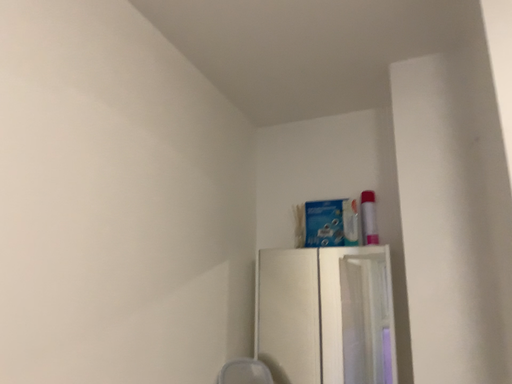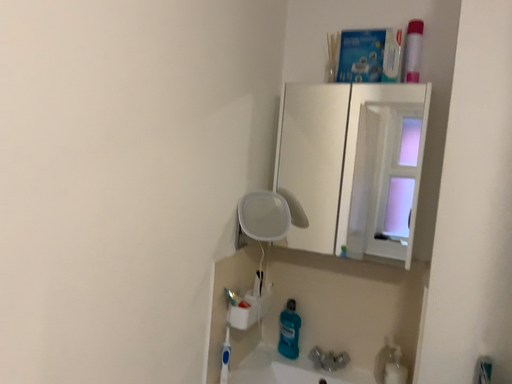
Question: Which way did the camera rotate in the video?

Choices:
 (A) rotated downward
 (B) rotated upward

Answer: (A)